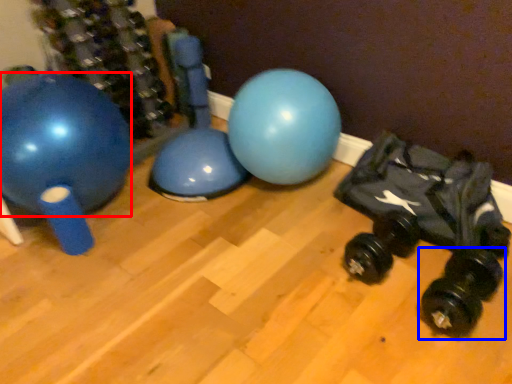
Question: Which of the following is the closest to the observer, ball (highlighted by a red box) or dumbbell (highlighted by a blue box)?

Choices:
 (A) ball
 (B) dumbbell

Answer: (B)